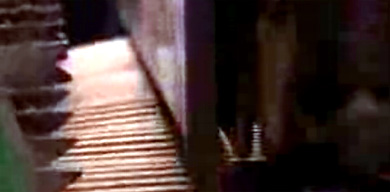
Identify the location of support beam. (257, 149).